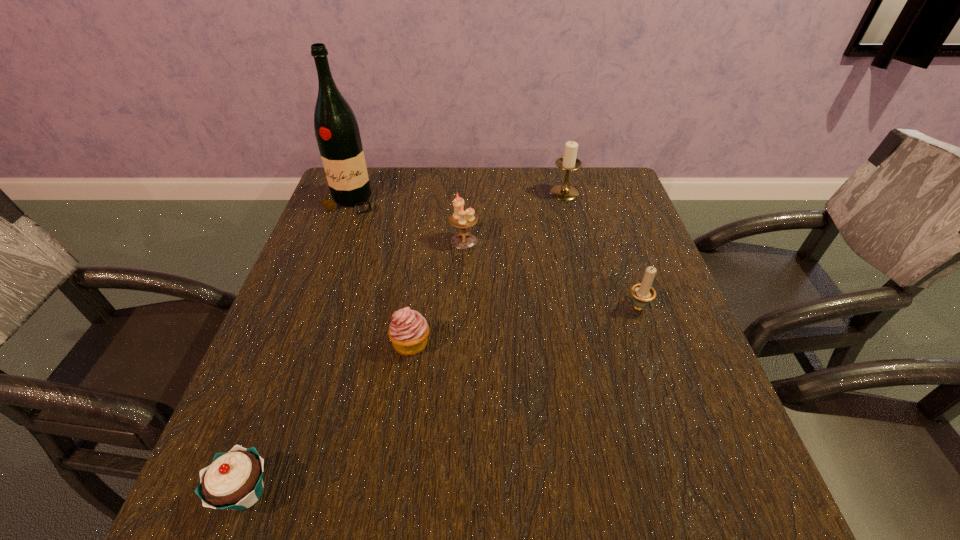
Locate an element on the screen. Image resolution: width=960 pixels, height=540 pixels. free space at the right edge of the desktop is located at coordinates (612, 261).

The image size is (960, 540). In the image, there is a desktop. In order to click on vacant space at the far left corner in this screenshot , I will do `click(344, 210)`.

The image size is (960, 540). In the image, there is a desktop. What are the coordinates of `blank space at the near left corner` in the screenshot? It's located at (200, 505).

The image size is (960, 540). Find the location of `vacant space at the far right corner of the desktop`. vacant space at the far right corner of the desktop is located at coordinates (584, 195).

What are the coordinates of `free spot between the second candle_holder from right to left and the right cupcake` in the screenshot? It's located at (488, 268).

Find the location of `free point between the third nearest object and the third object from right to left`. free point between the third nearest object and the third object from right to left is located at coordinates (551, 273).

Where is `free spot between the fourth object from left to right and the wine bottle`? The height and width of the screenshot is (540, 960). free spot between the fourth object from left to right and the wine bottle is located at coordinates (407, 221).

The width and height of the screenshot is (960, 540). I want to click on free space between the shortest candle_holder and the fourth shortest object, so click(551, 273).

Where is `free space between the wine bottle and the second nearest object`? This screenshot has width=960, height=540. free space between the wine bottle and the second nearest object is located at coordinates (381, 273).

Locate an element on the screen. Image resolution: width=960 pixels, height=540 pixels. free space between the wine bottle and the second farthest candle_holder is located at coordinates (407, 221).